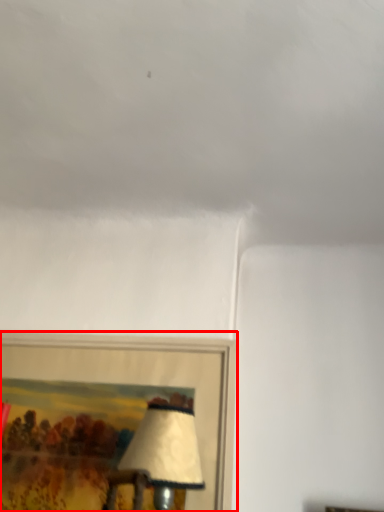
Question: From the image's perspective, what is the correct spatial positioning of picture frame (annotated by the red box) in reference to cloud?

Choices:
 (A) below
 (B) above

Answer: (A)